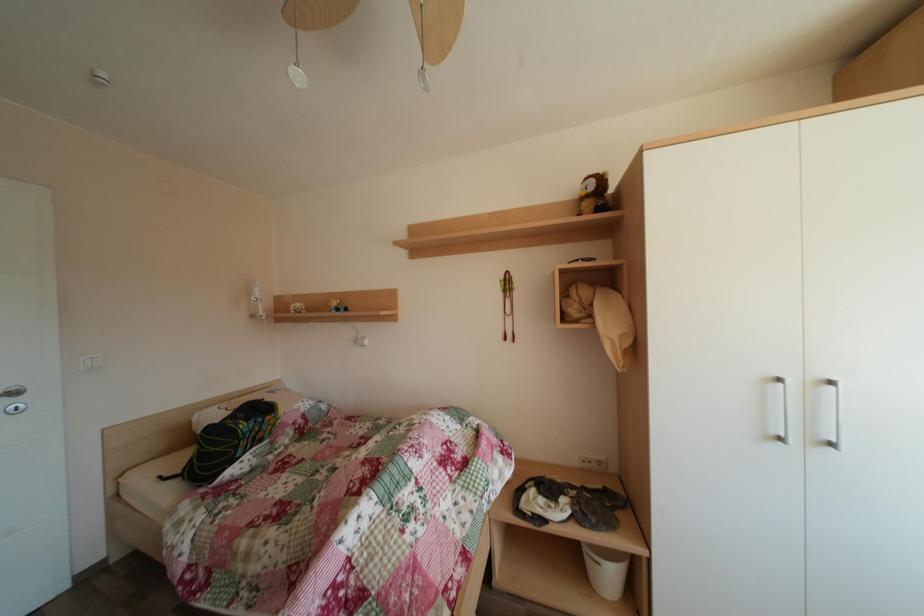
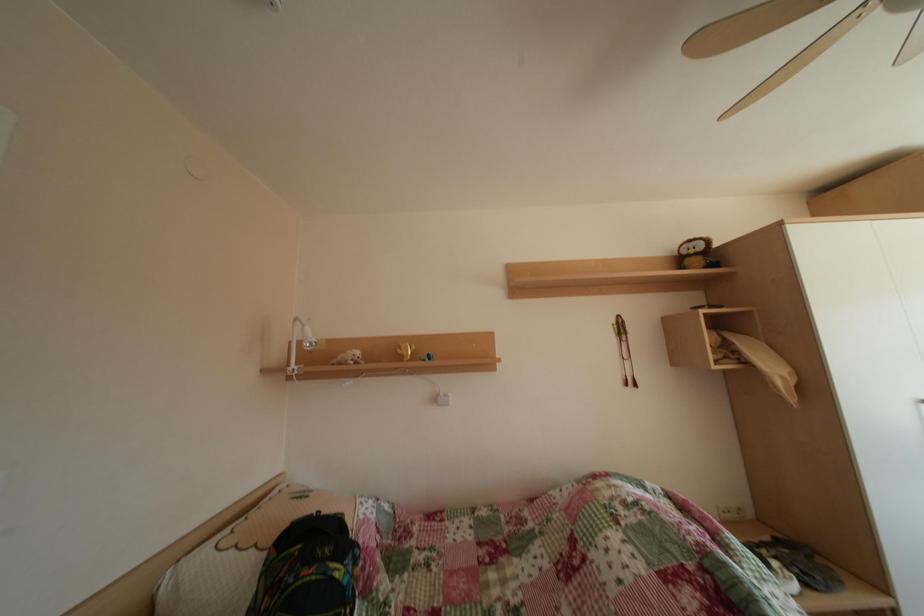
Question: The images are taken continuously from a first-person perspective. In which direction are you moving?

Choices:
 (A) Left
 (B) Right
 (C) Forward
 (D) Backward

Answer: (A)